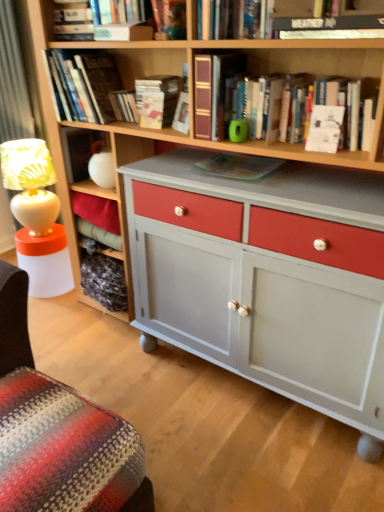
Question: Is hardcover book at upper center, which is counted as the 1th book, starting from the left, to the left or to the right of matte green paperback book at center, positioned as the second paperback book in right-to-left order, in the image?

Choices:
 (A) left
 (B) right

Answer: (A)

Question: From the image's perspective, relative to matte green paperback book at center, the third paperback book in the back-to-front sequence, is hardcover book at upper center, which is counted as the 1th book, starting from the left, above or below?

Choices:
 (A) above
 (B) below

Answer: (A)

Question: Which is farther from the matte green paperback book at center, positioned as the second paperback book in right-to-left order?

Choices:
 (A) hardcover book at upper center, which appears as the third book when viewed from the left
 (B) white fabric lampshade at left
 (C) hardcover book at upper center, which is counted as the 1th book, starting from the left
 (D) hardcover book at upper center, acting as the 1th paperback book starting from the left
 (E) hardcover book at upper center, the 6th book when ordered from left to right

Answer: (B)

Question: Which object is the closest to the hardcover book at upper center, the seventh book from the right?

Choices:
 (A) hardcover book at upper center, acting as the 1th paperback book starting from the left
 (B) white fabric lampshade at left
 (C) hardcover book at upper center, the 6th book when ordered from left to right
 (D) matte plastic book at upper center, marked as the 3th book in a right-to-left arrangement
 (E) matte paper at upper center, which is counted as the 2th paperback book, starting from the left

Answer: (A)